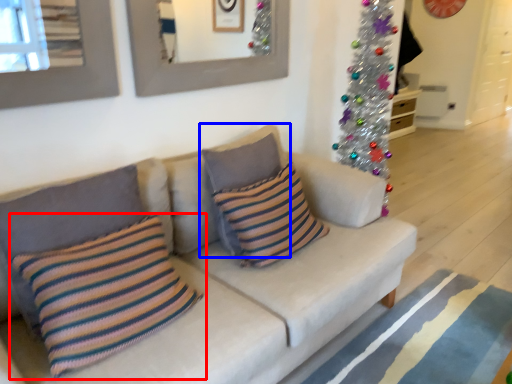
Question: Which object appears closest to the camera in this image, pillow (highlighted by a red box) or pillow (highlighted by a blue box)?

Choices:
 (A) pillow
 (B) pillow

Answer: (A)